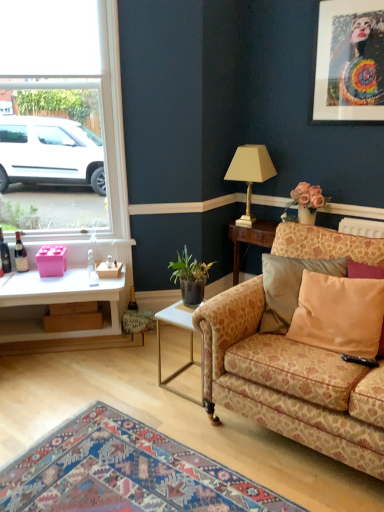
Where is `vacant space situated on the left part of white metal side table at lower center`? vacant space situated on the left part of white metal side table at lower center is located at coordinates (139, 381).